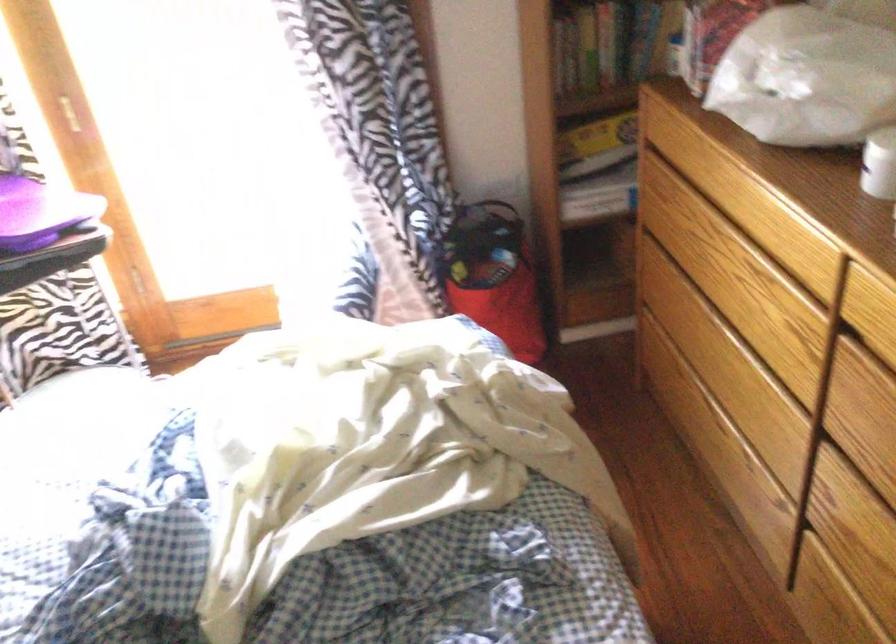
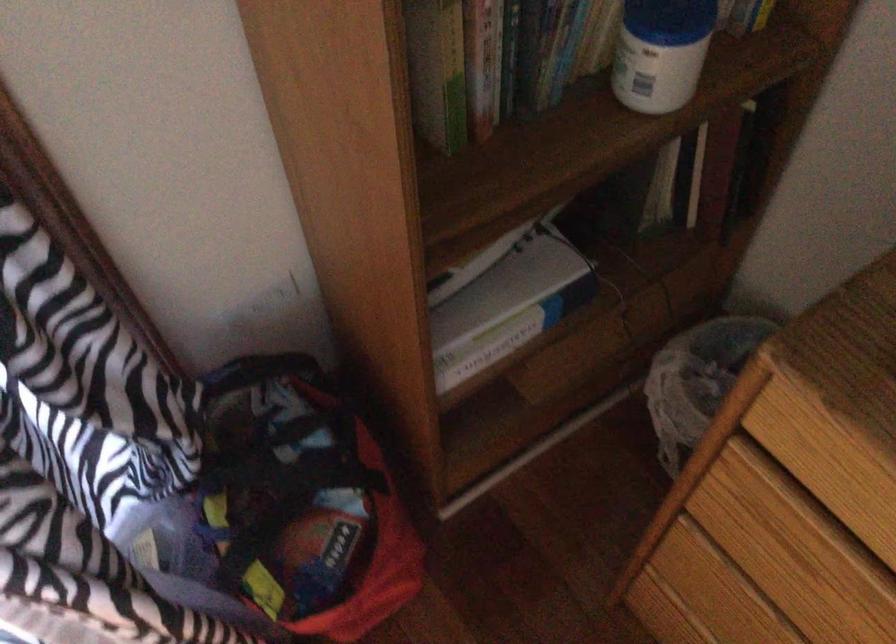
Question: I am providing you with two images of the same scene from different viewpoints. After the viewpoint changes to image2, which objects are now occluded?

Choices:
 (A) orange paper bag
 (B) book
 (C) small trash can
 (D) wooden drawer handle

Answer: (B)